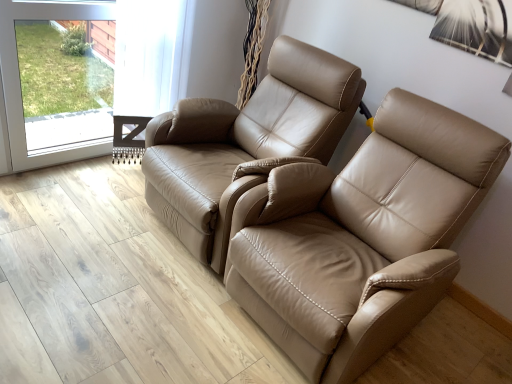
Locate an element on the screen. vacant space in front of tan leather chair at center, the first chair from the left is located at coordinates tap(124, 312).